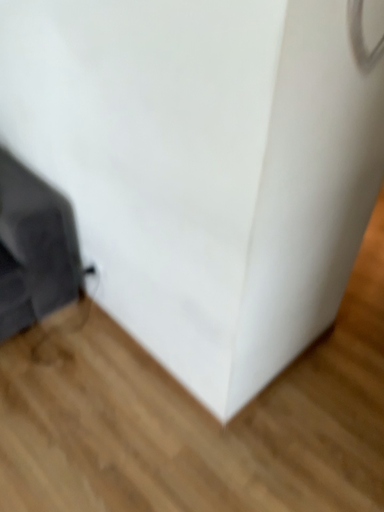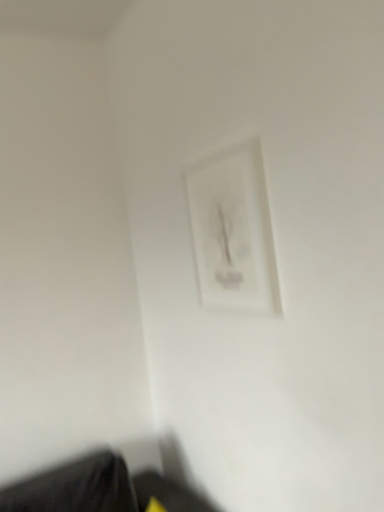
Question: How did the camera likely rotate when shooting the video?

Choices:
 (A) rotated upward
 (B) rotated downward

Answer: (A)